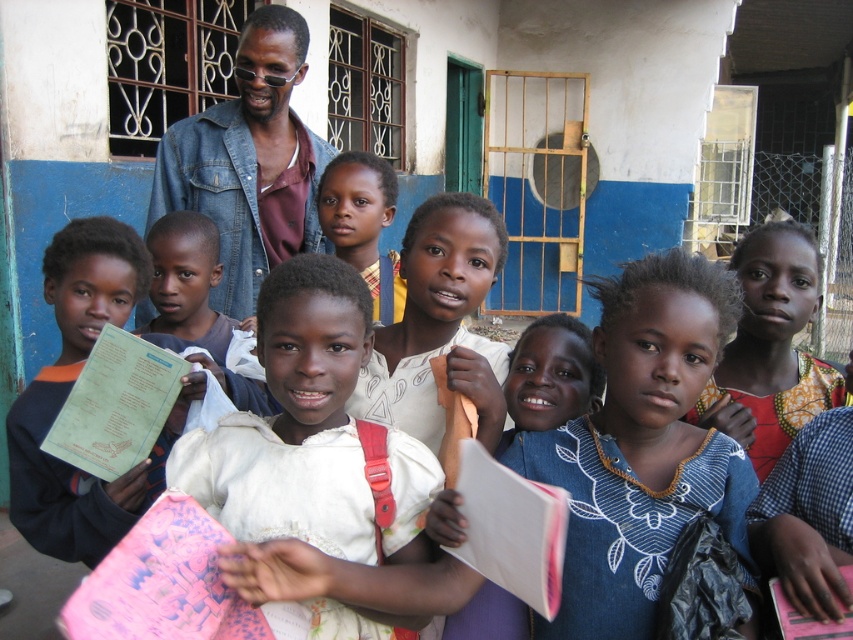
Question: Can you confirm if white cotton dress at center is thinner than matte green book at center?

Choices:
 (A) no
 (B) yes

Answer: (A)

Question: Is denim jacket at upper center smaller than printed fabric dress at center?

Choices:
 (A) yes
 (B) no

Answer: (B)

Question: Among these objects, which one is nearest to the camera?

Choices:
 (A) printed fabric dress at center
 (B) matte green book at center

Answer: (A)

Question: Where is white cotton dress at center located in relation to printed fabric dress at center in the image?

Choices:
 (A) left
 (B) right

Answer: (A)

Question: Which object is farther from the camera taking this photo?

Choices:
 (A) smooth skin face at center
 (B) denim jacket at upper center
 (C) matte green book at center
 (D) printed fabric dress at center

Answer: (B)

Question: Which object is farther from the camera taking this photo?

Choices:
 (A) denim jacket at upper center
 (B) printed fabric dress at center
 (C) white cotton dress at center
 (D) smooth skin face at center

Answer: (A)